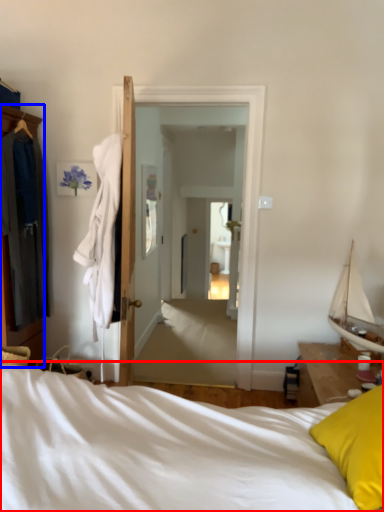
Question: Which of the following is the closest to the observer, bed (highlighted by a red box) or cabinetry (highlighted by a blue box)?

Choices:
 (A) bed
 (B) cabinetry

Answer: (A)